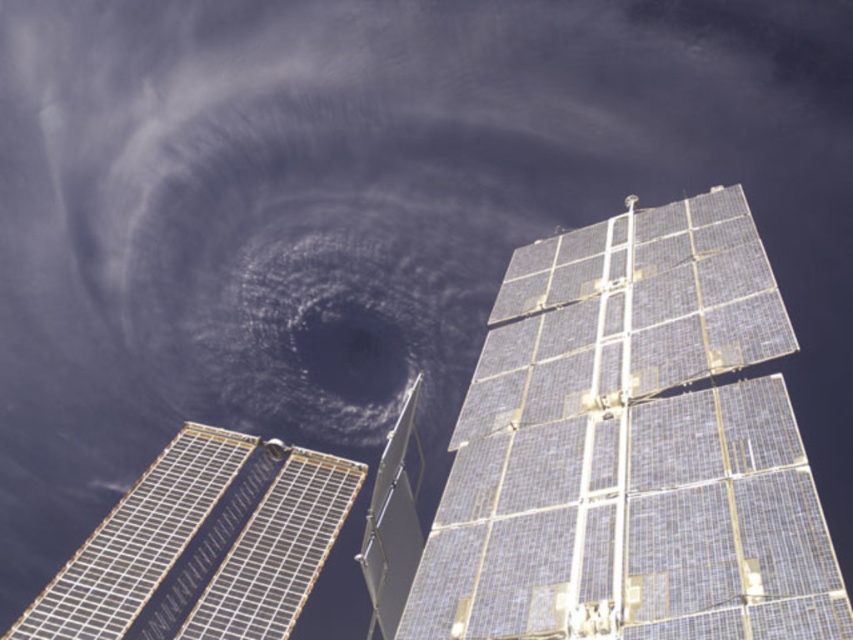
Question: Which of the following is the closest to the observer?

Choices:
 (A) dark blue/gray cloud at center
 (B) blue metallic solar panel at upper right
 (C) silver metallic solar panel at lower left

Answer: (B)

Question: Observing the image, what is the correct spatial positioning of blue metallic solar panel at upper right in reference to dark blue/gray cloud at center?

Choices:
 (A) left
 (B) right

Answer: (B)

Question: Which object is the farthest from the dark blue/gray cloud at center?

Choices:
 (A) blue metallic solar panel at upper right
 (B) silver metallic solar panel at lower left

Answer: (A)

Question: Can you confirm if blue metallic solar panel at upper right is thinner than silver metallic solar panel at lower left?

Choices:
 (A) no
 (B) yes

Answer: (B)

Question: Does blue metallic solar panel at upper right come in front of dark blue/gray cloud at center?

Choices:
 (A) no
 (B) yes

Answer: (B)

Question: Considering the real-world distances, which object is closest to the blue metallic solar panel at upper right?

Choices:
 (A) dark blue/gray cloud at center
 (B) silver metallic solar panel at lower left

Answer: (B)